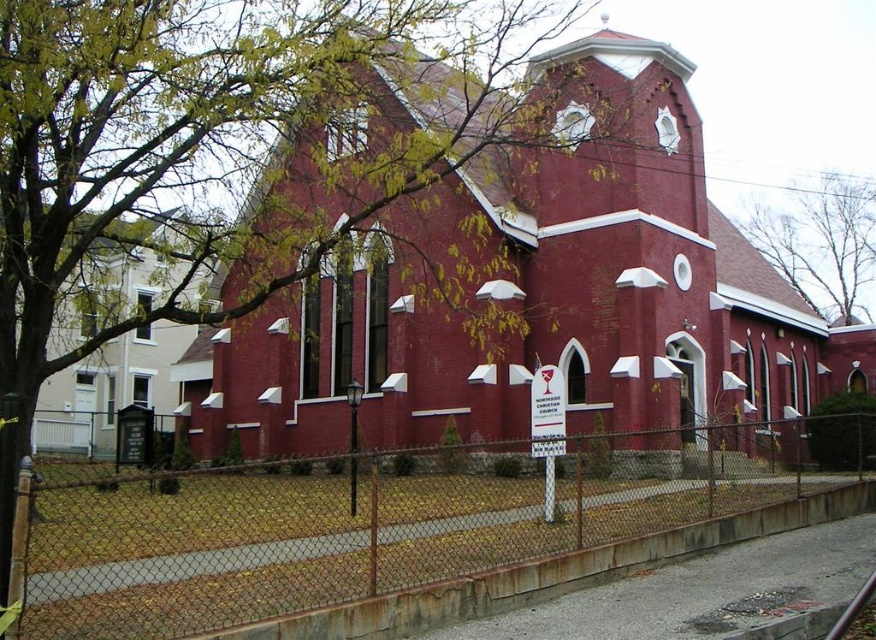
Is matte brick church at center shorter than brown leafy tree at upper center?

Incorrect, matte brick church at center's height does not fall short of brown leafy tree at upper center's.

Is point (219, 413) farther from camera compared to point (845, 317)?

No, it is in front of (845, 317).

Where is `matte brick church at center`? matte brick church at center is located at coordinates (546, 304).

Who is taller, matte brick church at center or rusty chain-link fence at lower center?

matte brick church at center is taller.

Is matte brick church at center further to the viewer compared to rusty chain-link fence at lower center?

Yes.

Image resolution: width=876 pixels, height=640 pixels. I want to click on matte brick church at center, so [546, 304].

Where is `matte brick church at center`? Image resolution: width=876 pixels, height=640 pixels. matte brick church at center is located at coordinates (546, 304).

Who is lower down, rusty chain-link fence at lower center or brown leafy tree at upper center?

rusty chain-link fence at lower center

You are a GUI agent. You are given a task and a screenshot of the screen. Output one action in this format:
    pyautogui.click(x=<x>, y=<y>)
    Task: Click on the rusty chain-link fence at lower center
    The width and height of the screenshot is (876, 640).
    Given the screenshot: What is the action you would take?
    pyautogui.click(x=380, y=522)

Image resolution: width=876 pixels, height=640 pixels. I want to click on rusty chain-link fence at lower center, so click(380, 522).